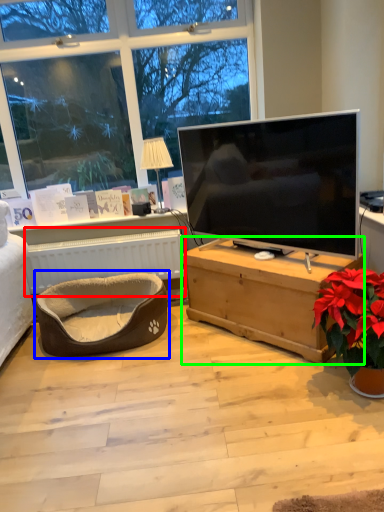
Question: Based on their relative distances, which object is nearer to radiator (highlighted by a red box)? Choose from bean bag chair (highlighted by a blue box) and desk (highlighted by a green box).

Choices:
 (A) bean bag chair
 (B) desk

Answer: (A)